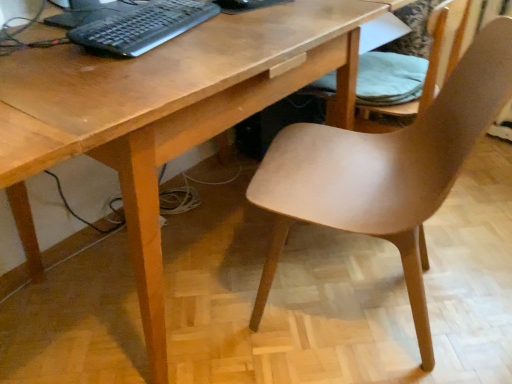
Question: From a real-world perspective, is black plastic keyboard at upper left above or below matte wood chair at center, arranged as the second chair when viewed from the back?

Choices:
 (A) above
 (B) below

Answer: (A)

Question: From their relative heights in the image, would you say black plastic keyboard at upper left is taller or shorter than matte wood chair at center, arranged as the second chair when viewed from the back?

Choices:
 (A) short
 (B) tall

Answer: (A)

Question: Which object is the farthest from the matte wood chair at lower right, arranged as the second chair when viewed from the front?

Choices:
 (A) black plastic keyboard at upper left
 (B) matte wood chair at center, which is the 1th chair from front to back

Answer: (A)

Question: Which of these objects is positioned farthest from the matte wood chair at center, which is the 1th chair from front to back?

Choices:
 (A) black plastic keyboard at upper left
 (B) matte wood chair at lower right, marked as the 1th chair in a back-to-front arrangement

Answer: (A)